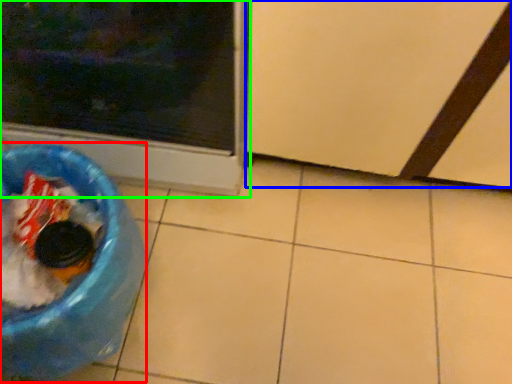
Question: Estimate the real-world distances between objects in this image. Which object is closer to recycling bin (highlighted by a red box), screen door (highlighted by a blue box) or home appliance (highlighted by a green box)?

Choices:
 (A) screen door
 (B) home appliance

Answer: (B)